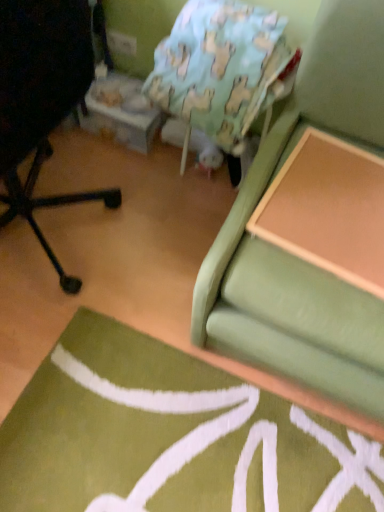
You are a GUI agent. You are given a task and a screenshot of the screen. Output one action in this format:
    pyautogui.click(x=<x>, y=<y>)
    Task: Click on the free space above wooden table at upper right (from a real-world perspective)
    
    Given the screenshot: What is the action you would take?
    pyautogui.click(x=332, y=196)